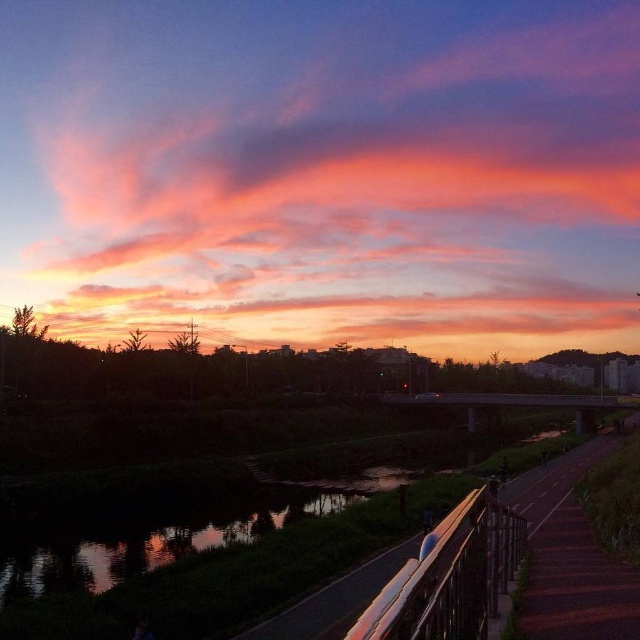
Is satin silver railing at lower center further to camera compared to reflective glass water at center?

No, satin silver railing at lower center is in front of reflective glass water at center.

What do you see at coordinates (451, 577) in the screenshot? This screenshot has width=640, height=640. I see `satin silver railing at lower center` at bounding box center [451, 577].

Does point (481, 586) come behind point (339, 504)?

No, it is not.

Identify the location of satin silver railing at lower center. The height and width of the screenshot is (640, 640). (451, 577).

Is smooth asphalt path at lower right wider than reflective glass water at center?

Correct, the width of smooth asphalt path at lower right exceeds that of reflective glass water at center.

Between smooth asphalt path at lower right and reflective glass water at center, which one appears on the right side from the viewer's perspective?

smooth asphalt path at lower right is more to the right.

I want to click on smooth asphalt path at lower right, so click(x=572, y=556).

Is smooth asphalt path at lower right closer to camera compared to satin silver railing at lower center?

No, smooth asphalt path at lower right is behind satin silver railing at lower center.

You are a GUI agent. You are given a task and a screenshot of the screen. Output one action in this format:
    pyautogui.click(x=<x>, y=<y>)
    Task: Click on the smooth asphalt path at lower right
    The image size is (640, 640).
    Given the screenshot: What is the action you would take?
    pyautogui.click(x=572, y=556)